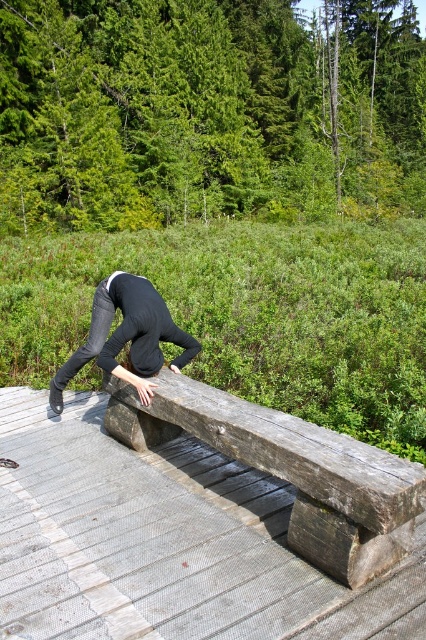
You are a photographer trying to capture the wooden bench at center and the dark gray jeans at center in a single shot. Since you want to emphasize the size difference between them, which object should you focus on to ensure the larger one is clearly visible?

The wooden bench at center has a larger size compared to dark gray jeans at center, so focusing on the wooden bench at center will ensure the larger object is clearly visible in the photo.

Looking at this image, you are a photographer trying to capture the wooden bench at center and the dark gray jeans at center in a single shot. Based on their positions, which object should you focus on first to ensure both are in sharp focus?

The wooden bench at center is closer to the viewer than the dark gray jeans at center, so you should focus on the wooden bench at center first to ensure both are in sharp focus.

You are a photographer setting up a shot of the wooden bench at center and dark gray jeans at center. You need to ensure that both objects are in focus. Which object should you adjust your camera focus to prioritize first?

The wooden bench at center is shorter than dark gray jeans at center, so you should prioritize focusing on the dark gray jeans at center first because it is taller and might be more prominent in the frame.